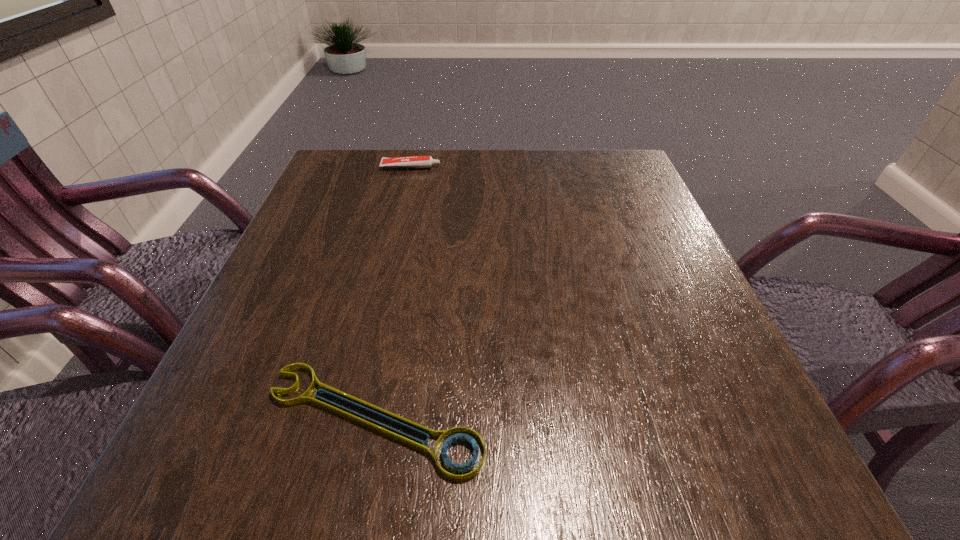
You are a GUI agent. You are given a task and a screenshot of the screen. Output one action in this format:
    pyautogui.click(x=<x>, y=<y>)
    Task: Click on the object at the far left corner
    This screenshot has height=540, width=960.
    Given the screenshot: What is the action you would take?
    pyautogui.click(x=413, y=161)

What are the coordinates of `object that is positioned at the near left corner` in the screenshot? It's located at (460, 435).

The width and height of the screenshot is (960, 540). I want to click on vacant area at the far edge, so click(425, 171).

The height and width of the screenshot is (540, 960). I want to click on vacant space at the left edge of the desktop, so click(x=336, y=316).

At what (x,y) coordinates should I click in order to perform the action: click on free region at the right edge of the desktop. Please return your answer as a coordinate pair (x, y). Image resolution: width=960 pixels, height=540 pixels. Looking at the image, I should click on (600, 237).

Locate an element on the screen. The width and height of the screenshot is (960, 540). vacant space at the far right corner of the desktop is located at coordinates (595, 182).

The height and width of the screenshot is (540, 960). Find the location of `vacant point that satisfies the following two spatial constraints: 1. at the nozzle of the farther object; 2. on the right side of the wrench`. vacant point that satisfies the following two spatial constraints: 1. at the nozzle of the farther object; 2. on the right side of the wrench is located at coordinates (353, 419).

Find the location of a particular element. Image resolution: width=960 pixels, height=540 pixels. vacant area that satisfies the following two spatial constraints: 1. at the nozzle of the taller object; 2. on the right side of the nearer object is located at coordinates (353, 419).

Locate an element on the screen. blank space that satisfies the following two spatial constraints: 1. at the nozzle of the farther object; 2. on the right side of the wrench is located at coordinates (353, 419).

This screenshot has width=960, height=540. I want to click on free location that satisfies the following two spatial constraints: 1. at the nozzle of the farther object; 2. on the back side of the shorter object, so click(x=353, y=419).